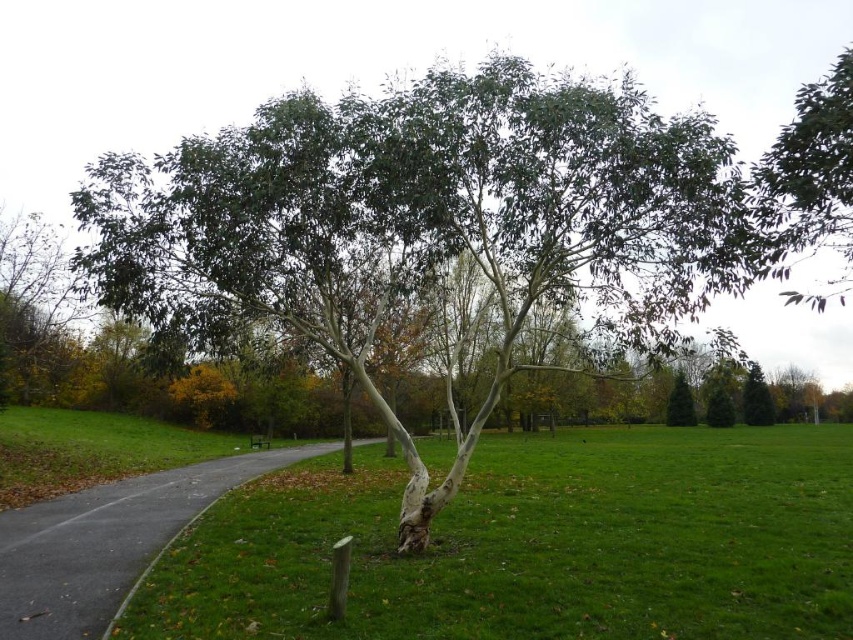
Question: Among these objects, which one is farthest from the camera?

Choices:
 (A) green matte tree at upper right
 (B) gray asphalt path at center
 (C) green matte tree at center

Answer: (C)

Question: Can you confirm if green matte tree at center is positioned above green grassy at center?

Choices:
 (A) yes
 (B) no

Answer: (A)

Question: Does green matte tree at center appear over gray asphalt path at center?

Choices:
 (A) no
 (B) yes

Answer: (B)

Question: Based on their relative distances, which object is nearer to the green grassy at center?

Choices:
 (A) green matte tree at upper right
 (B) green matte tree at center

Answer: (B)

Question: Based on their relative distances, which object is farther from the gray asphalt path at center?

Choices:
 (A) green matte tree at upper right
 (B) green matte tree at center

Answer: (A)

Question: Does green grassy at center appear on the left side of gray asphalt path at center?

Choices:
 (A) no
 (B) yes

Answer: (A)